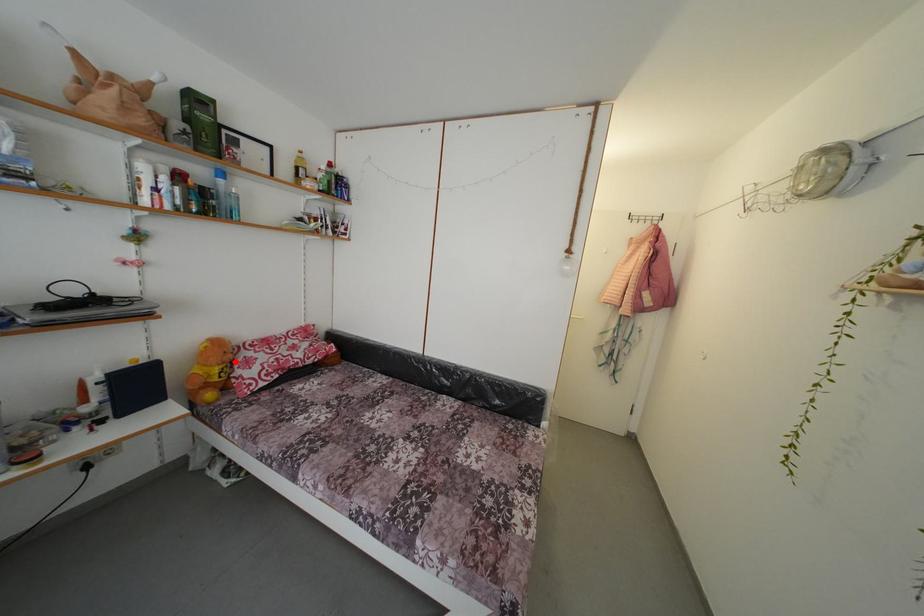
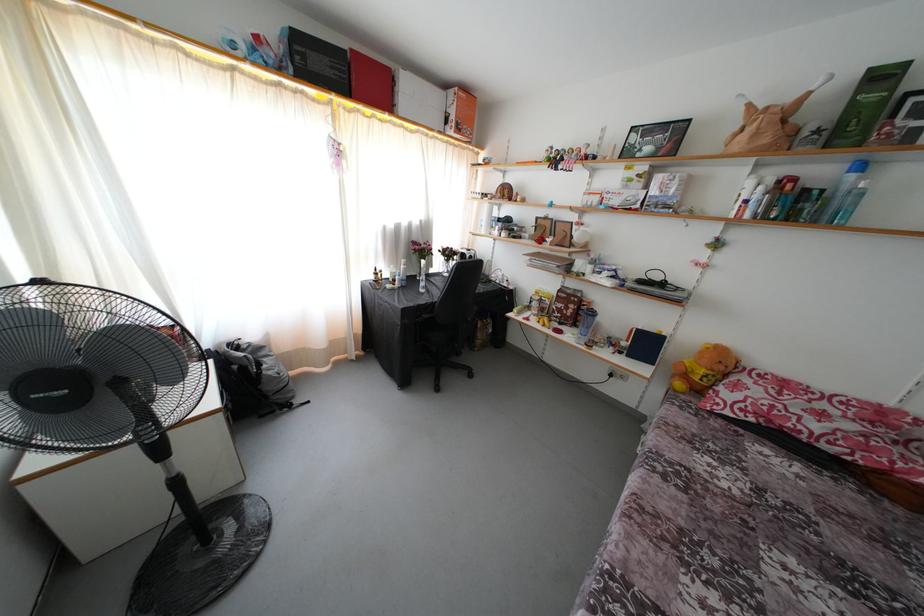
The point at the highlighted location is marked in the first image. Where is the corresponding point in the second image?

(726, 373)